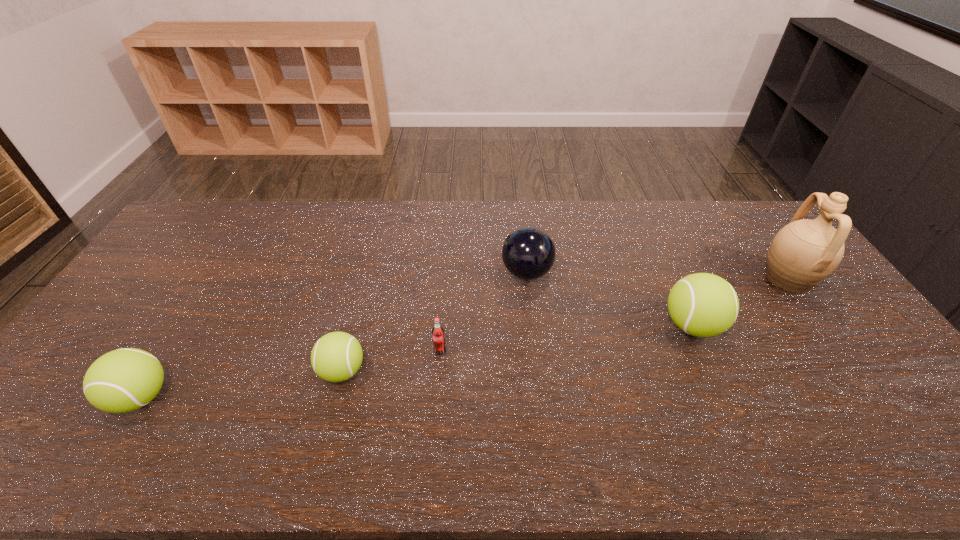
Where is `object present at the near left corner`? object present at the near left corner is located at coordinates (123, 380).

This screenshot has width=960, height=540. In the image, there is a desktop. What are the coordinates of `vacant space at the far edge` in the screenshot? It's located at (576, 230).

In the image, there is a desktop. At what (x,y) coordinates should I click in order to perform the action: click on free region at the near edge. Please return your answer as a coordinate pair (x, y). Looking at the image, I should click on (827, 407).

Locate an element on the screen. free space at the left edge is located at coordinates (155, 307).

This screenshot has height=540, width=960. In the image, there is a desktop. Find the location of `blank space at the far left corner`. blank space at the far left corner is located at coordinates (199, 224).

Locate an element on the screen. The height and width of the screenshot is (540, 960). vacant space in between the fourth object from left to right and the fourth object from right to left is located at coordinates (483, 312).

Find the location of a particular element. Image resolution: width=960 pixels, height=540 pixels. vacant space that is in between the leftmost object and the tallest object is located at coordinates (464, 338).

Locate an element on the screen. vacant space in between the fifth object from left to right and the soda bottle is located at coordinates (566, 339).

Find the location of a particular element. The image size is (960, 540). free area in between the leftmost object and the farthest tennis ball is located at coordinates (417, 361).

Identify the location of vacant region between the soda bottle and the second tallest tennis ball. (291, 374).